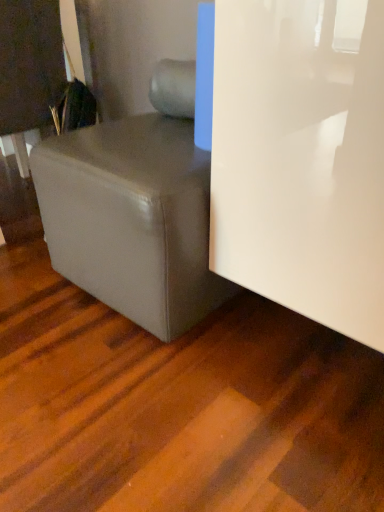
Question: Is white glossy door at right smaller than matte black book at upper left?

Choices:
 (A) no
 (B) yes

Answer: (A)

Question: Considering the relative positions of white glossy door at right and matte black book at upper left in the image provided, is white glossy door at right to the left of matte black book at upper left from the viewer's perspective?

Choices:
 (A) yes
 (B) no

Answer: (B)

Question: From the image's perspective, is white glossy door at right located beneath matte black book at upper left?

Choices:
 (A) yes
 (B) no

Answer: (A)

Question: From a real-world perspective, does white glossy door at right stand above matte black book at upper left?

Choices:
 (A) no
 (B) yes

Answer: (A)

Question: Can you confirm if white glossy door at right is shorter than matte black book at upper left?

Choices:
 (A) no
 (B) yes

Answer: (A)

Question: Is matte black book at upper left taller or shorter than matte gray ottoman at lower left?

Choices:
 (A) short
 (B) tall

Answer: (B)

Question: From the image's perspective, is matte black book at upper left above or below matte gray ottoman at lower left?

Choices:
 (A) above
 (B) below

Answer: (A)

Question: Is point (23, 47) positioned closer to the camera than point (107, 125)?

Choices:
 (A) closer
 (B) farther

Answer: (B)

Question: Relative to matte gray ottoman at lower left, is matte black book at upper left in front or behind?

Choices:
 (A) behind
 (B) front

Answer: (A)

Question: From the image's perspective, relative to white glossy door at right, is matte black book at upper left above or below?

Choices:
 (A) below
 (B) above

Answer: (B)

Question: Looking at their shapes, would you say matte black book at upper left is wider or thinner than white glossy door at right?

Choices:
 (A) thin
 (B) wide

Answer: (A)

Question: Looking at the image, does matte black book at upper left seem bigger or smaller compared to white glossy door at right?

Choices:
 (A) big
 (B) small

Answer: (B)

Question: From a real-world perspective, relative to white glossy door at right, is matte black book at upper left vertically above or below?

Choices:
 (A) above
 (B) below

Answer: (A)

Question: Would you say white glossy door at right is to the left or to the right of matte black book at upper left in the picture?

Choices:
 (A) left
 (B) right

Answer: (B)

Question: Is white glossy door at right spatially inside matte black book at upper left, or outside of it?

Choices:
 (A) outside
 (B) inside

Answer: (A)